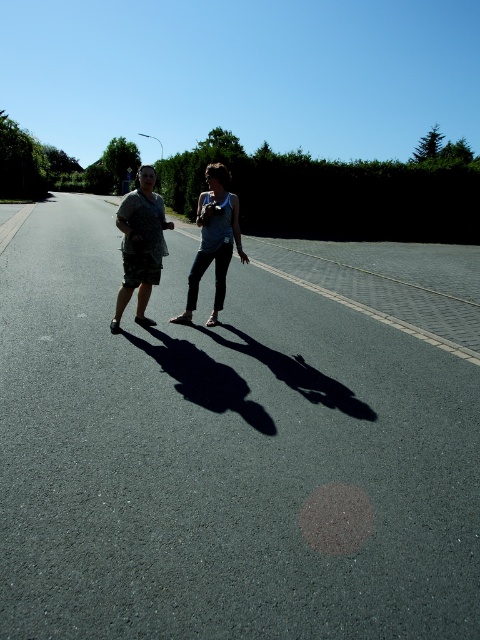
You are a photographer standing on the sidewalk and want to take a photo of both the camouflage fabric dress at center and the camouflage shorts at center. Which one will appear larger in the photo?

The camouflage fabric dress at center will appear larger in the photo because it is closer to the viewer than the camouflage shorts at center.

You are a photographer trying to capture a photo of the two people in the image. You want to focus on the camouflage fabric dress at center and camouflage shorts at center. Which of these two items is positioned higher on the person?

The camouflage fabric dress at center is positioned higher on the person than the camouflage shorts at center because it is above it according to the description.